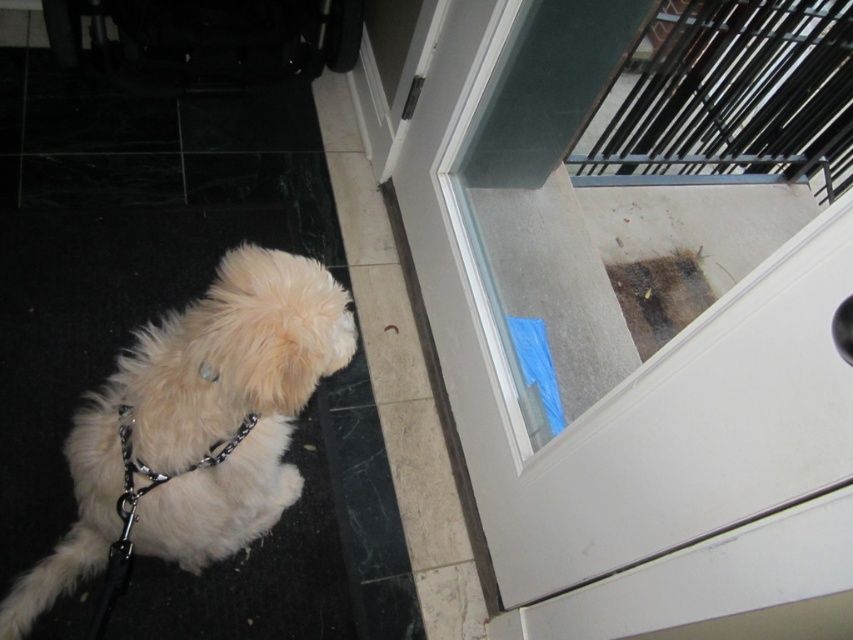
You are a delivery person trying to enter the house. There is a small dog on the dark, glossy tiled floor wearing a black leash. You notice a point marked at coordinates (645, 307). Based on the scene, what object is located at that point?

The point at coordinates (645, 307) indicates a transparent glass screen door at upper right.

You are the dog in the image. You want to go outside through the open door. There are two points marked on the floor. One is at point [799,397] and the other is at point [213,307]. Which point is closer to the door?

Point [799,397] is in front of point [213,307], so it is closer to the door.

You are a delivery person holding a package that requires you to walk through the space between the transparent glass screen door at upper right and the white fluffy dog at lower left. The package is 3 feet wide. Can you safely pass through without squeezing?

The distance between the transparent glass screen door at upper right and the white fluffy dog at lower left is 33.61 inches. Since 3 feet equals 36 inches, the package is wider than the available space. You cannot safely pass through without squeezing.